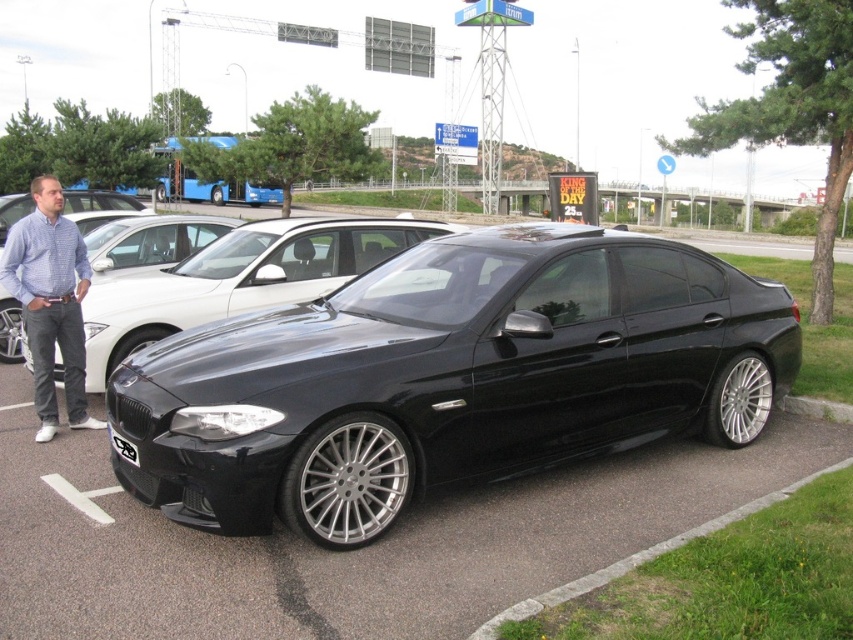
You are standing in the parking lot and see two points marked on the ground. The first point is at coordinates point (209, 285) and the second is at point (113, 445). Which point is closer to you?

Point (113, 445) is closer to you because it is less further to the camera than point (209, 285).

You are a parking attendant who needs to ensure vehicles fit within the parking spaces. Given that the glossy black car at center is parked in a standard parking space, can you confirm if its width is within the designated limits based on the comparison with the blue checkered shirt at left?

The glossy black car at center has a lesser width compared to the blue checkered shirt at left, so it is likely within the designated parking space width limits.